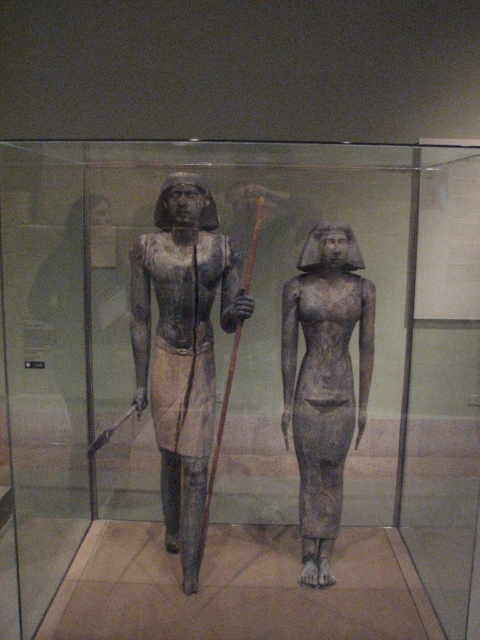
You are a museum visitor standing in front of the glass case containing the two statues. You want to take a photo of the matte stone statue at center without the gray stone statue at center appearing in the background. Is this possible given their positions?

The matte stone statue at center is located above the gray stone statue at center, so if you position yourself lower and focus on the upper part of the glass case, you can capture the matte stone statue at center while excluding the gray stone statue at center from the frame.